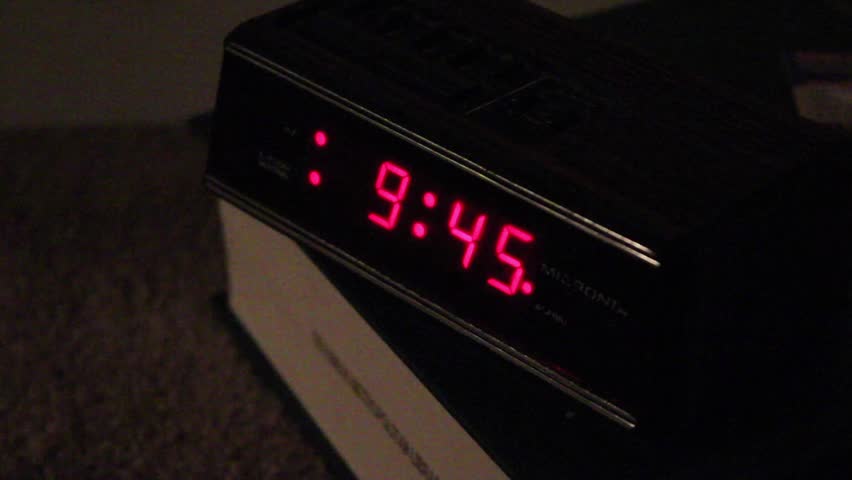
At what (x,y) coordinates should I click in order to perform the action: click on wall. Please return your answer as a coordinate pair (x, y). Looking at the image, I should click on (141, 47).